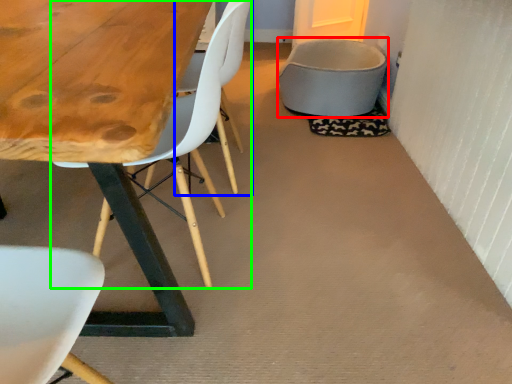
Question: Estimate the real-world distances between objects in this image. Which object is farther from gray (highlighted by a red box), armchair (highlighted by a blue box) or chair (highlighted by a green box)?

Choices:
 (A) armchair
 (B) chair

Answer: (B)